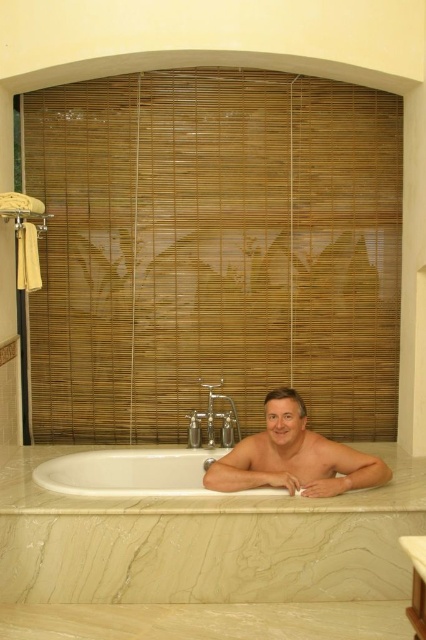
You are standing in the bathroom and want to place a small candle between the two points, point (x=45, y=529) and point (x=288, y=413). Which point should the candle be closer to if you want it to be near the man in the bathtub?

The candle should be placed closer to point (x=45, y=529) because it is closer to the viewer, which is where the man in the bathtub is located.

You are a photographer setting up a shoot in this bathroom. You need to ensure the smooth skin man at center and the white glossy bathtub at lower left are both visible in the frame. Given their sizes, which object should you prioritize positioning closer to the camera to maintain detail?

Since the smooth skin man at center is smaller than the white glossy bathtub at lower left, you should position the smooth skin man at center closer to the camera to ensure both are visible with adequate detail.